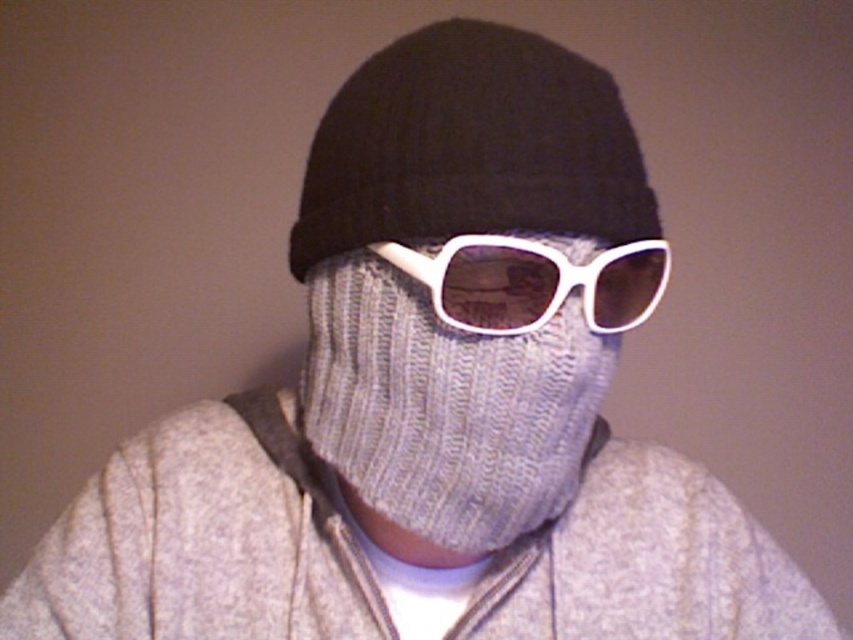
Based on the photo, you are a safety inspector checking the equipment of a worker. The worker is wearing a knitted gray mask at center and white plastic goggles at center. According to safety protocols, the mask must be worn above the goggles. Is the worker complying with the safety protocol?

The knitted gray mask at center is positioned under the white plastic goggles at center, so the worker is not complying with the safety protocol because the mask should be worn above the goggles.

You are a fashion designer trying to create a new look using the black knitted hat at center and the white plastic goggles at center. Can you place the hat in a way that it doesn not cover the goggles?

The black knitted hat at center is positioned over white plastic goggles at center, so it is currently covering them. To avoid covering the goggles, the hat should be adjusted to sit lower on the head, allowing the goggles to be visible above the hat.